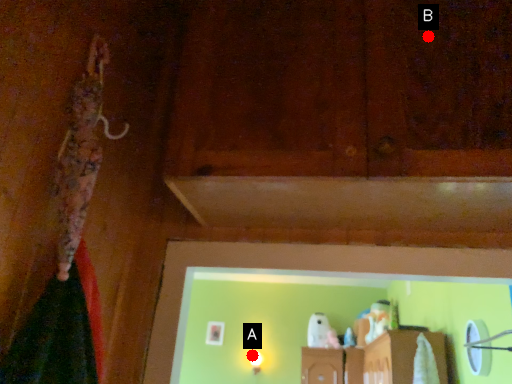
Question: Two points are circled on the image, labeled by A and B beside each circle. Which point appears closest to the camera in this image?

Choices:
 (A) A is closer
 (B) B is closer

Answer: (B)